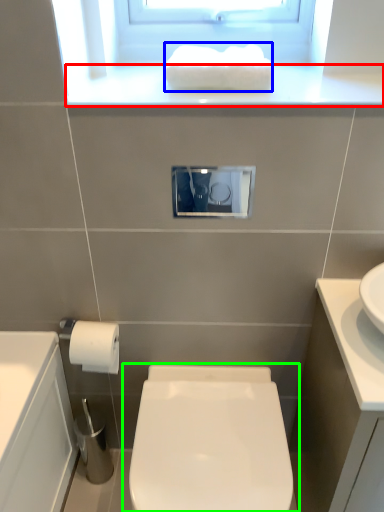
Question: Which object is the farthest from window sill (highlighted by a red box)? Choose among these: hand towel (highlighted by a blue box) or toilet (highlighted by a green box).

Choices:
 (A) hand towel
 (B) toilet

Answer: (B)